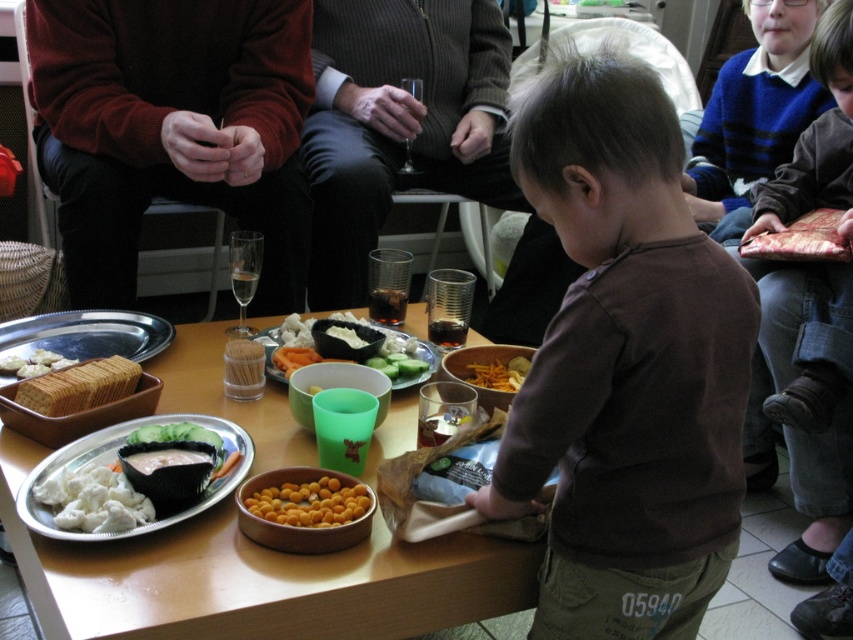
Question: Which of the following is the farthest from the observer?

Choices:
 (A) white creamy cheese at lower left
 (B) yellow matte snack bowl at center
 (C) wooden table at center
 (D) golden crispy chips at center

Answer: (D)

Question: Is brown cotton shirt at center behind wooden table at center?

Choices:
 (A) no
 (B) yes

Answer: (B)

Question: Among these points, which one is farthest from the camera?

Choices:
 (A) (50, 412)
 (B) (397, 349)
 (C) (125, 433)
 (D) (358, 339)

Answer: (B)

Question: Is white matte platter at center thinner than white crumbly cheese at center?

Choices:
 (A) yes
 (B) no

Answer: (B)

Question: Can you confirm if smooth plastic bowl at center is positioned to the left of golden crispy chips at center?

Choices:
 (A) no
 (B) yes

Answer: (B)

Question: Which point is closer to the camera?

Choices:
 (A) (91, 448)
 (B) (634, 618)
 (C) (498, 360)

Answer: (B)